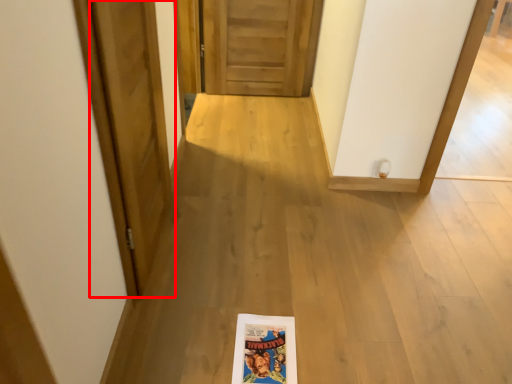
Question: Where is door (annotated by the red box) located in relation to door in the image?

Choices:
 (A) left
 (B) right

Answer: (A)